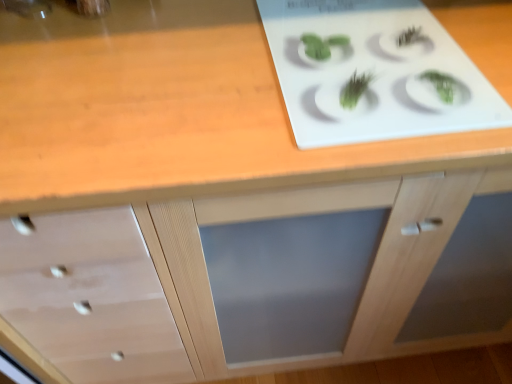
Find the location of a particular element. Image resolution: width=512 pixels, height=384 pixels. empty space that is ontop of white matte book cover at upper right is located at coordinates 358,46.